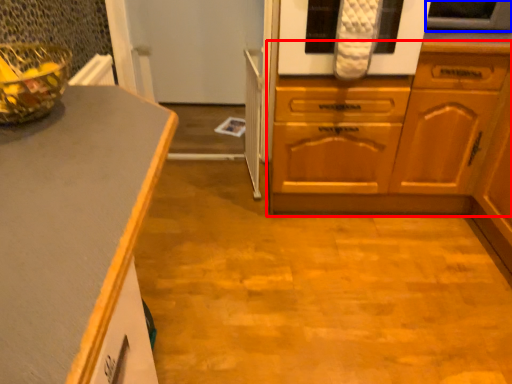
Question: Which point is closer to the camera, cabinetry (highlighted by a red box) or appliance (highlighted by a blue box)?

Choices:
 (A) cabinetry
 (B) appliance

Answer: (A)